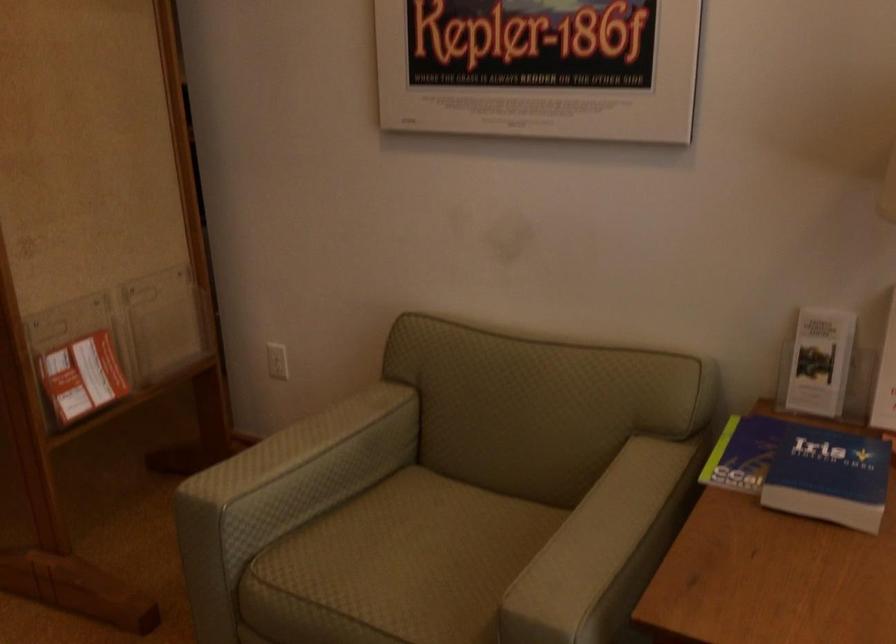
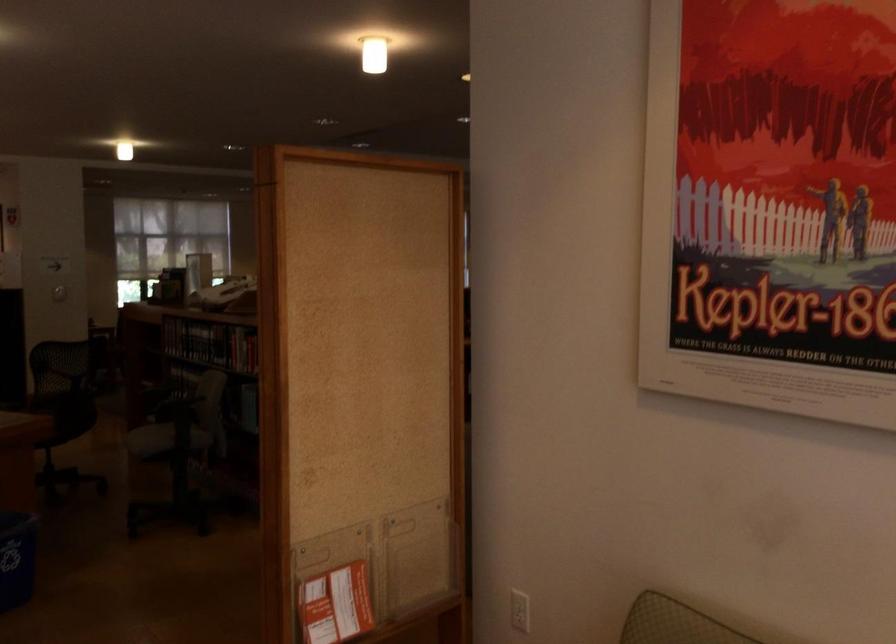
In the second image, find the point that corresponds to (272,366) in the first image.

(520, 610)